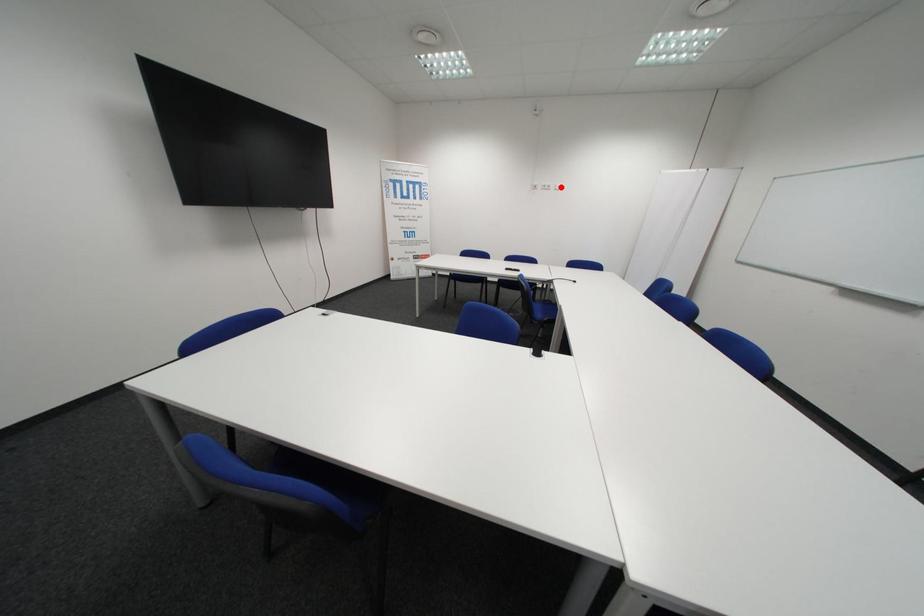
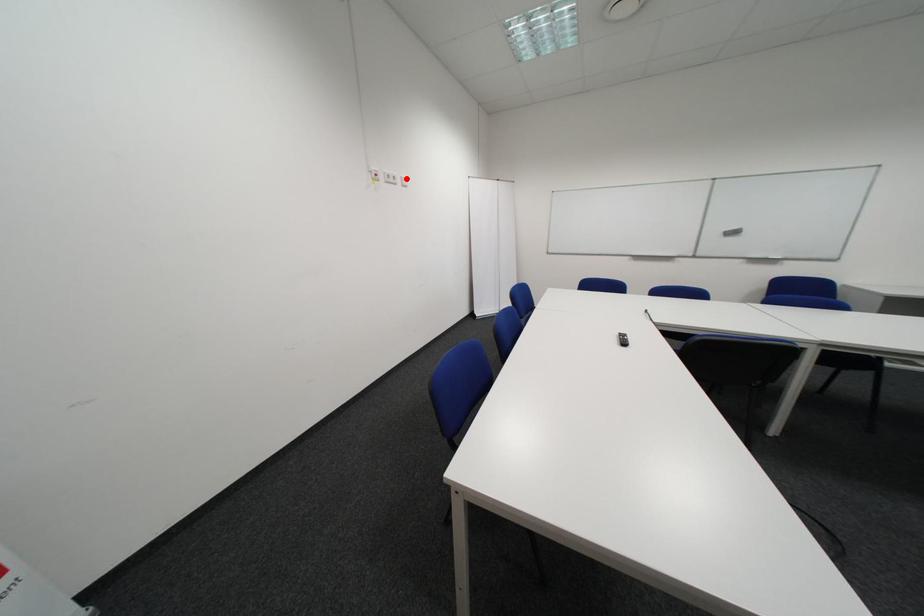
I am providing you with two images of the same scene from different viewpoints. A red point is marked on the first image and another point is marked on the second image. Is the marked point in image1 the same physical position as the marked point in image2?

Yes